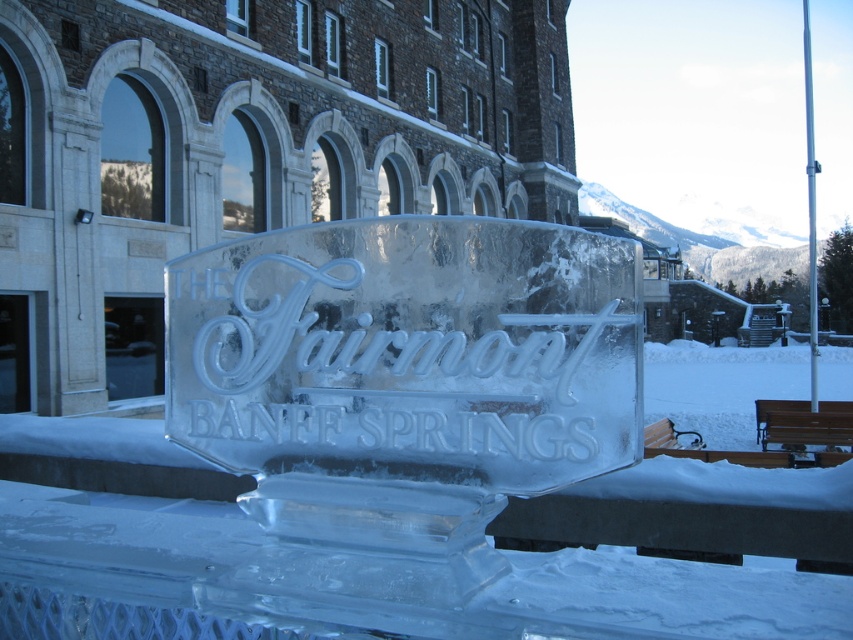
Question: Is transparent ice at center wider than brown wooden bench at lower right?

Choices:
 (A) yes
 (B) no

Answer: (A)

Question: Is transparent ice at center thinner than brown wooden bench at lower right?

Choices:
 (A) no
 (B) yes

Answer: (A)

Question: Among these objects, which one is farthest from the camera?

Choices:
 (A) brown wooden bench at lower right
 (B) transparent ice at center

Answer: (A)

Question: Can you confirm if transparent ice at center is wider than brown wooden bench at lower right?

Choices:
 (A) yes
 (B) no

Answer: (A)